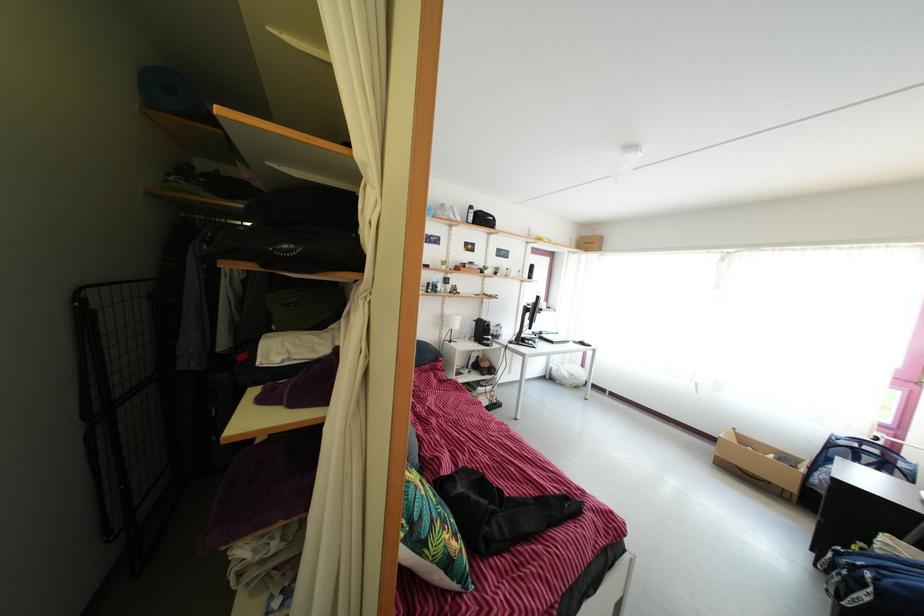
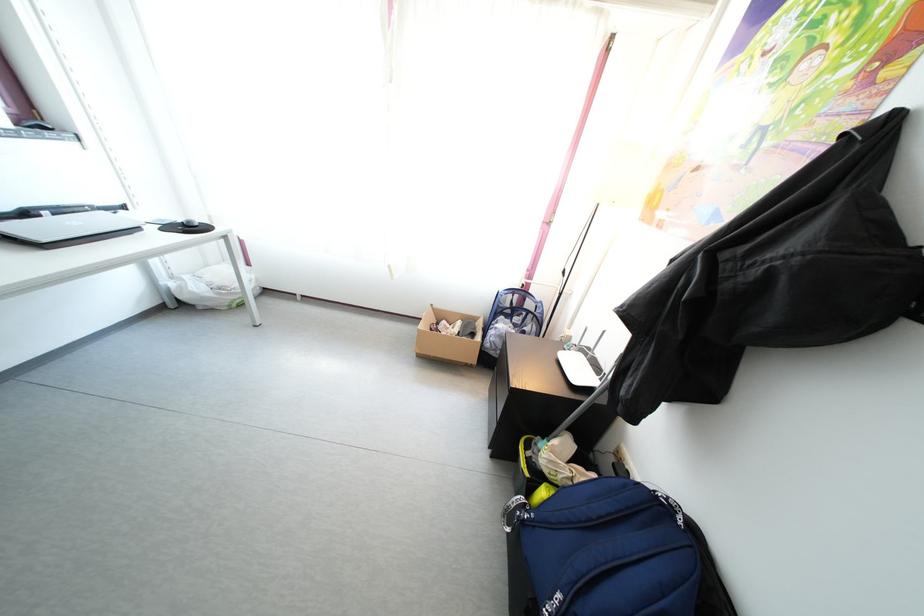
The point at (546,341) is marked in the first image. Where is the corresponding point in the second image?

(31, 222)